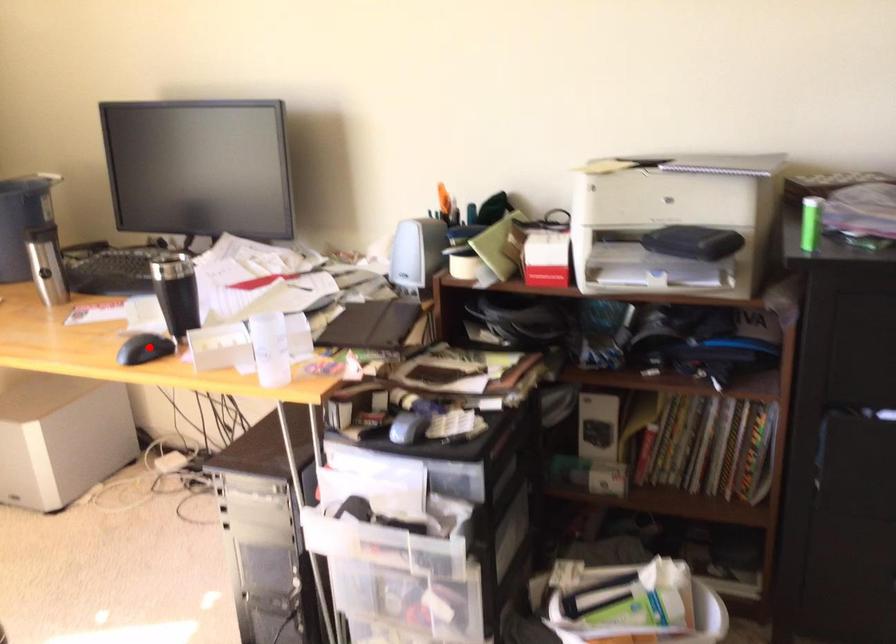
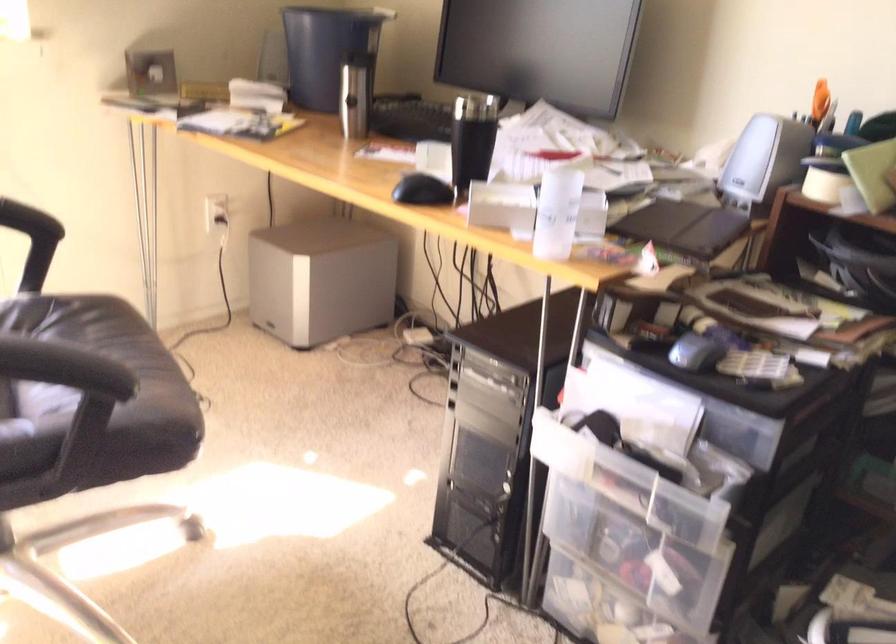
Question: I am providing you with two images of the same scene from different viewpoints. Image1 has a red point marked. In image2, the corresponding 3D location appears at what relative position? Reply with the corresponding letter.

Choices:
 (A) Closer
 (B) Farther

Answer: (A)